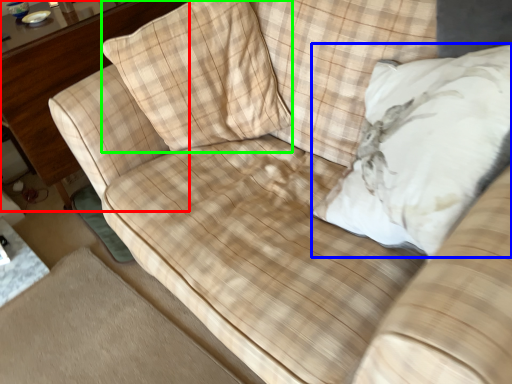
Question: Estimate the real-world distances between objects in this image. Which object is farther from dresser (highlighted by a red box), throw pillow (highlighted by a blue box) or throw pillow (highlighted by a green box)?

Choices:
 (A) throw pillow
 (B) throw pillow

Answer: (A)